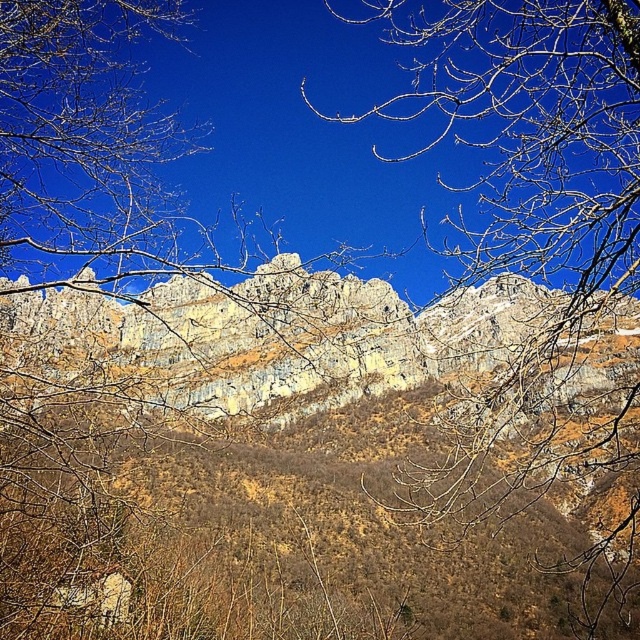
Question: Among these objects, which one is farthest from the camera?

Choices:
 (A) rugged stone mountain at center
 (B) bare branches at upper center

Answer: (A)

Question: Is bare branches at upper center positioned behind rugged stone mountain at center?

Choices:
 (A) no
 (B) yes

Answer: (A)

Question: Which of the following is the closest to the observer?

Choices:
 (A) bare branches at upper center
 (B) rugged stone mountain at center

Answer: (A)

Question: Where is bare branches at upper center located in relation to rugged stone mountain at center in the image?

Choices:
 (A) right
 (B) left

Answer: (A)

Question: Can you confirm if bare branches at upper center is positioned below rugged stone mountain at center?

Choices:
 (A) no
 (B) yes

Answer: (A)